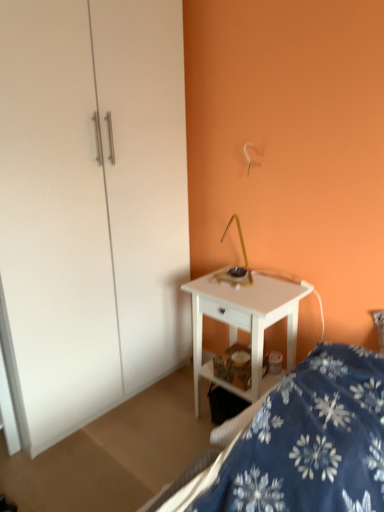
Question: From a real-world perspective, is white glossy dresser at center above or below blue floral fabric bed at lower right?

Choices:
 (A) below
 (B) above

Answer: (B)

Question: Is white glossy dresser at center wider or thinner than blue floral fabric bed at lower right?

Choices:
 (A) thin
 (B) wide

Answer: (B)

Question: Based on their relative distances, which object is nearer to the white glossy dresser at center?

Choices:
 (A) blue floral fabric bed at lower right
 (B) white glossy desk at center

Answer: (B)

Question: Which object is positioned farthest from the white glossy dresser at center?

Choices:
 (A) blue floral fabric bed at lower right
 (B) white glossy desk at center

Answer: (A)